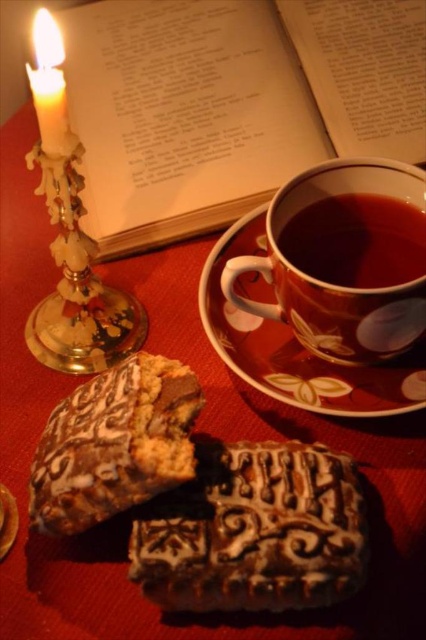
Between brown glossy mug at upper center and white wax candle at upper left, which one has more height?

white wax candle at upper left is taller.

Who is positioned more to the right, brown glossy mug at upper center or white wax candle at upper left?

brown glossy mug at upper center

Does point (414, 237) come behind point (49, 61)?

Yes, it is.

Where is `brown glossy mug at upper center`? brown glossy mug at upper center is located at coordinates (356, 241).

Which of these two, gold metallic candle holder at left or white wax candle at upper left, stands taller?

gold metallic candle holder at left is taller.

Who is shorter, gold metallic candle holder at left or white wax candle at upper left?

white wax candle at upper left is shorter.

Between point (69, 321) and point (32, 42), which one is positioned in front?

Point (69, 321) is more forward.

In order to click on gold metallic candle holder at left in this screenshot , I will do `click(77, 284)`.

Between paper book at upper center and chocolate-dipped cookie at center, which one has less height?

Standing shorter between the two is chocolate-dipped cookie at center.

Is paper book at upper center below chocolate-dipped cookie at center?

Actually, paper book at upper center is above chocolate-dipped cookie at center.

Which is behind, point (391, 32) or point (48, 420)?

Point (391, 32)

Where is `paper book at upper center`? paper book at upper center is located at coordinates (232, 102).